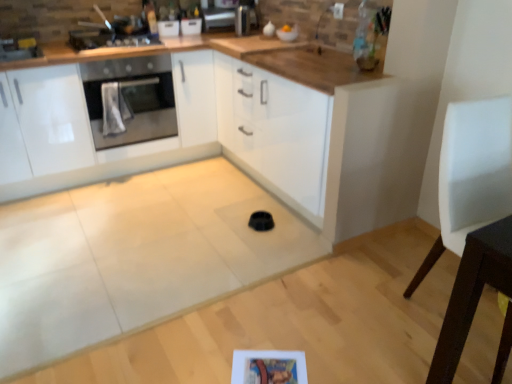
Question: From a real-world perspective, is stainless steel oven at left over metallic stainless steel oven at upper left?

Choices:
 (A) no
 (B) yes

Answer: (A)

Question: Is stainless steel oven at left facing away from metallic stainless steel oven at upper left?

Choices:
 (A) no
 (B) yes

Answer: (A)

Question: Is stainless steel oven at left smaller than metallic stainless steel oven at upper left?

Choices:
 (A) no
 (B) yes

Answer: (A)

Question: Considering the relative sizes of stainless steel oven at left and metallic stainless steel oven at upper left in the image provided, is stainless steel oven at left thinner than metallic stainless steel oven at upper left?

Choices:
 (A) yes
 (B) no

Answer: (B)

Question: Considering the relative sizes of stainless steel oven at left and metallic stainless steel oven at upper left in the image provided, is stainless steel oven at left bigger than metallic stainless steel oven at upper left?

Choices:
 (A) no
 (B) yes

Answer: (B)

Question: Is point (50, 178) positioned closer to the camera than point (505, 304)?

Choices:
 (A) closer
 (B) farther

Answer: (B)

Question: From the image's perspective, is white glossy cabinets at center positioned above or below white leather chair at right?

Choices:
 (A) above
 (B) below

Answer: (A)

Question: Is white glossy cabinets at center in front of or behind white leather chair at right in the image?

Choices:
 (A) behind
 (B) front

Answer: (A)

Question: Would you say white glossy cabinets at center is inside or outside white leather chair at right?

Choices:
 (A) outside
 (B) inside

Answer: (A)

Question: In terms of height, does satin silver toaster at upper center look taller or shorter compared to stainless steel oven at left?

Choices:
 (A) short
 (B) tall

Answer: (A)

Question: Is satin silver toaster at upper center spatially inside stainless steel oven at left, or outside of it?

Choices:
 (A) inside
 (B) outside

Answer: (B)

Question: Relative to stainless steel oven at left, is satin silver toaster at upper center in front or behind?

Choices:
 (A) behind
 (B) front

Answer: (A)

Question: From the image's perspective, is satin silver toaster at upper center above or below stainless steel oven at left?

Choices:
 (A) above
 (B) below

Answer: (A)

Question: In terms of height, does stainless steel oven at left look taller or shorter compared to white leather chair at right?

Choices:
 (A) tall
 (B) short

Answer: (B)

Question: Is stainless steel oven at left inside or outside of white leather chair at right?

Choices:
 (A) outside
 (B) inside

Answer: (A)